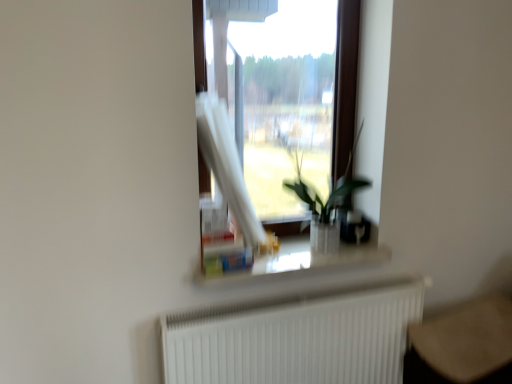
Question: Does white matte radiator at lower center appear on the left side of white glossy window sill at center?

Choices:
 (A) no
 (B) yes

Answer: (A)

Question: Is white matte radiator at lower center positioned far away from white glossy window sill at center?

Choices:
 (A) yes
 (B) no

Answer: (B)

Question: Does white matte radiator at lower center have a smaller size compared to white glossy window sill at center?

Choices:
 (A) yes
 (B) no

Answer: (B)

Question: Is white matte radiator at lower center to the right of white glossy window sill at center from the viewer's perspective?

Choices:
 (A) yes
 (B) no

Answer: (A)

Question: Is white matte radiator at lower center bigger than white glossy window sill at center?

Choices:
 (A) yes
 (B) no

Answer: (A)

Question: Is white matte radiator at lower center next to white glossy window sill at center?

Choices:
 (A) no
 (B) yes

Answer: (A)

Question: Is white matte radiator at lower center bigger than green leafy plant at center?

Choices:
 (A) yes
 (B) no

Answer: (A)

Question: From a real-world perspective, is white matte radiator at lower center located higher than green leafy plant at center?

Choices:
 (A) yes
 (B) no

Answer: (B)

Question: Is the surface of white matte radiator at lower center in direct contact with green leafy plant at center?

Choices:
 (A) yes
 (B) no

Answer: (B)

Question: Considering the relative sizes of white matte radiator at lower center and green leafy plant at center in the image provided, is white matte radiator at lower center thinner than green leafy plant at center?

Choices:
 (A) yes
 (B) no

Answer: (A)

Question: Can you confirm if white matte radiator at lower center is positioned to the left of green leafy plant at center?

Choices:
 (A) yes
 (B) no

Answer: (A)

Question: Is there a large distance between white matte radiator at lower center and green leafy plant at center?

Choices:
 (A) no
 (B) yes

Answer: (A)

Question: Is green leafy plant at center not near white matte radiator at lower center?

Choices:
 (A) no
 (B) yes

Answer: (A)